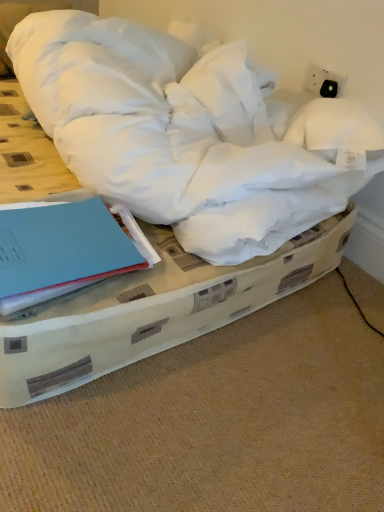
The height and width of the screenshot is (512, 384). What do you see at coordinates (65, 249) in the screenshot? I see `blue matte book at lower left` at bounding box center [65, 249].

This screenshot has height=512, width=384. I want to click on blue matte book at lower left, so click(65, 249).

Locate an element on the screen. The height and width of the screenshot is (512, 384). white soft bed at center is located at coordinates (152, 309).

Measure the distance between point (136, 315) and camera.

The distance of point (136, 315) from camera is 31.38 inches.

What do you see at coordinates (152, 309) in the screenshot? I see `white soft bed at center` at bounding box center [152, 309].

In order to click on blue matte book at lower left in this screenshot , I will do `click(65, 249)`.

Between white soft bed at center and blue matte book at lower left, which one appears on the right side from the viewer's perspective?

white soft bed at center is more to the right.

Which object is further away from the camera taking this photo, white soft bed at center or blue matte book at lower left?

blue matte book at lower left.

Is point (83, 341) behind point (85, 266)?

That is True.

From the image's perspective, which is below, white soft bed at center or blue matte book at lower left?

blue matte book at lower left is shown below in the image.

From a real-world perspective, is white soft bed at center located higher than blue matte book at lower left?

Actually, white soft bed at center is physically below blue matte book at lower left in the real world.

Between white soft bed at center and blue matte book at lower left, which one has larger width?

white soft bed at center is wider.

Considering the sizes of objects white soft bed at center and blue matte book at lower left in the image provided, who is taller, white soft bed at center or blue matte book at lower left?

blue matte book at lower left.

Considering the relative sizes of white soft bed at center and blue matte book at lower left in the image provided, is white soft bed at center bigger than blue matte book at lower left?

Indeed, white soft bed at center has a larger size compared to blue matte book at lower left.

Which is correct: white soft bed at center is inside blue matte book at lower left, or outside of it?

white soft bed at center is not enclosed by blue matte book at lower left.

Are white soft bed at center and blue matte book at lower left beside each other?

No, white soft bed at center is not in contact with blue matte book at lower left.

Is white soft bed at center turned away from blue matte book at lower left?

No, blue matte book at lower left is not at the back of white soft bed at center.

What's the angular difference between white soft bed at center and blue matte book at lower left's facing directions?

The angle between the facing direction of white soft bed at center and the facing direction of blue matte book at lower left is 0.0239 degrees.

Identify the location of paperback book above the white soft bed at center (from a real-world perspective). (65, 249).

Which is more to the right, blue matte book at lower left or white soft bed at center?

white soft bed at center.

Considering their positions, is blue matte book at lower left located in front of or behind white soft bed at center?

Visually, blue matte book at lower left is located behind white soft bed at center.

Is point (38, 229) closer or farther from the camera than point (150, 338)?

Point (38, 229) is positioned closer to the camera compared to point (150, 338).

From the image's perspective, does blue matte book at lower left appear lower than white soft bed at center?

Yes, from the image's perspective, blue matte book at lower left is beneath white soft bed at center.

From a real-world perspective, is blue matte book at lower left on white soft bed at center?

Indeed, from a real-world perspective, blue matte book at lower left stands above white soft bed at center.

Which object is wider, blue matte book at lower left or white soft bed at center?

white soft bed at center is wider.

Is blue matte book at lower left shorter than white soft bed at center?

No, blue matte book at lower left is not shorter than white soft bed at center.

Between blue matte book at lower left and white soft bed at center, which one has larger size?

With larger size is white soft bed at center.

Is blue matte book at lower left spatially inside white soft bed at center, or outside of it?

blue matte book at lower left is not inside white soft bed at center, it's outside.

Is blue matte book at lower left in contact with white soft bed at center?

No, blue matte book at lower left is not touching white soft bed at center.

Is blue matte book at lower left turned away from white soft bed at center?

No, blue matte book at lower left is not facing away from white soft bed at center.

How different are the orientations of blue matte book at lower left and white soft bed at center in degrees?

blue matte book at lower left and white soft bed at center are facing 0.0239 degrees away from each other.

At what (x,y) coordinates should I click in order to perform the action: click on paperback book that is behind the white soft bed at center. Please return your answer as a coordinate pair (x, y). The width and height of the screenshot is (384, 512). Looking at the image, I should click on tap(65, 249).

Locate an element on the screen. The width and height of the screenshot is (384, 512). bed on the right of blue matte book at lower left is located at coordinates (152, 309).

The height and width of the screenshot is (512, 384). I want to click on paperback book that is above the white soft bed at center (from a real-world perspective), so click(x=65, y=249).